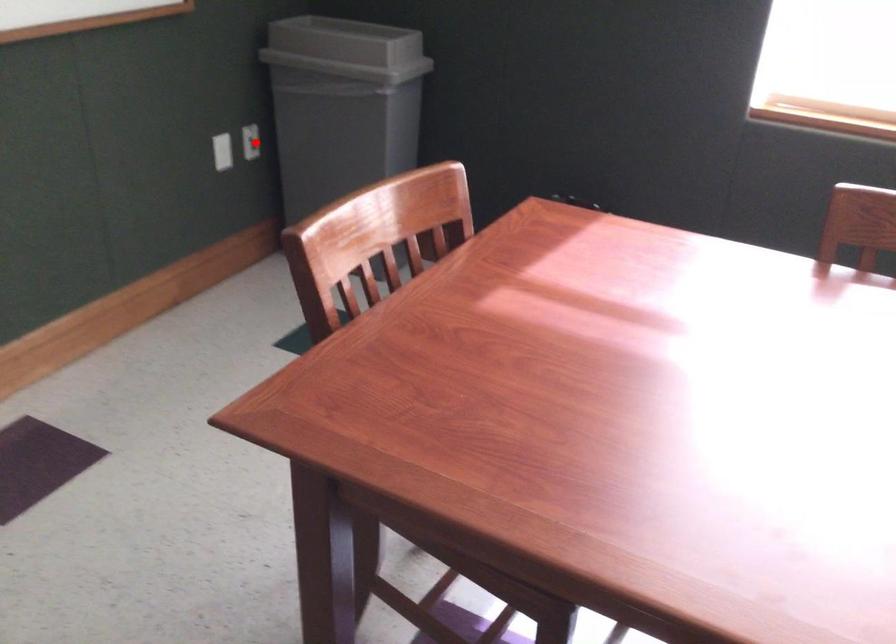
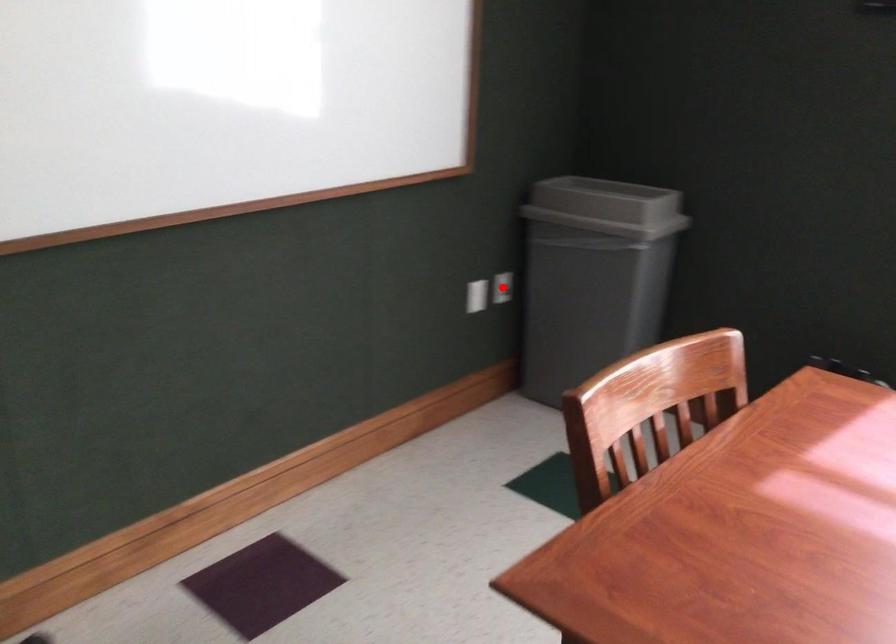
I am providing you with two images of the same scene from different viewpoints. A red point is marked on the first image and another point is marked on the second image. Is the marked point in image1 the same physical position as the marked point in image2?

Yes